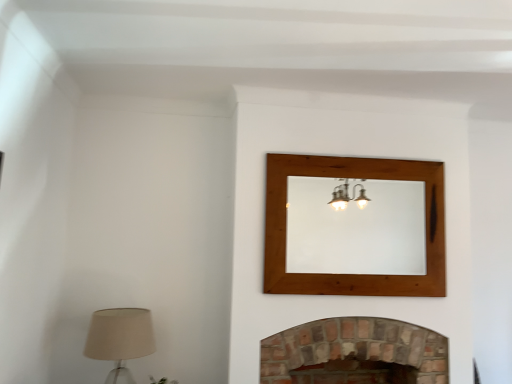
Question: From the image's perspective, is beige fabric lampshade at lower left above or below brick fireplace at lower center?

Choices:
 (A) below
 (B) above

Answer: (B)

Question: Would you say beige fabric lampshade at lower left is inside or outside brick fireplace at lower center?

Choices:
 (A) inside
 (B) outside

Answer: (B)

Question: Which of these objects is positioned closest to the wooden mirror at upper center?

Choices:
 (A) beige fabric lampshade at lower left
 (B) brick fireplace at lower center

Answer: (B)

Question: Which object is the closest to the wooden mirror at upper center?

Choices:
 (A) brick fireplace at lower center
 (B) beige fabric lampshade at lower left

Answer: (A)